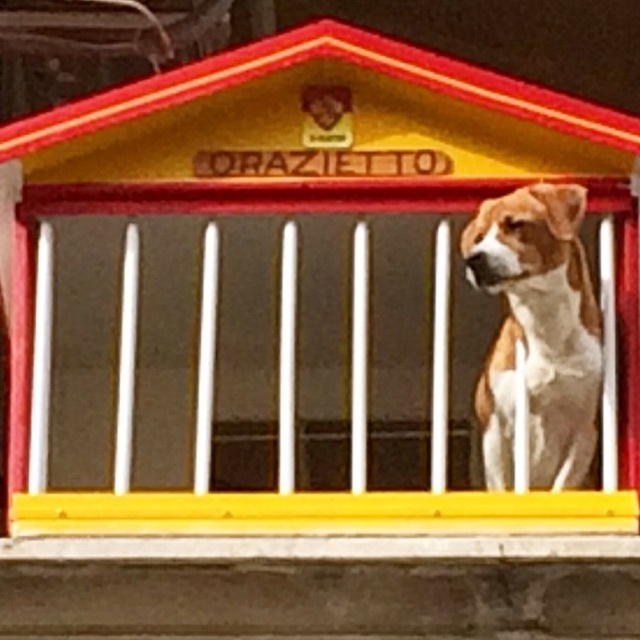
Question: Is yellow matte porch at center in front of brown and white fur dog at right?

Choices:
 (A) yes
 (B) no

Answer: (B)

Question: Which of the following is the farthest from the observer?

Choices:
 (A) brown and white fur dog at right
 (B) yellow matte porch at center

Answer: (B)

Question: Can you confirm if yellow matte porch at center is smaller than brown and white fur dog at right?

Choices:
 (A) yes
 (B) no

Answer: (B)

Question: Is yellow matte porch at center bigger than brown and white fur dog at right?

Choices:
 (A) no
 (B) yes

Answer: (B)

Question: Among these objects, which one is farthest from the camera?

Choices:
 (A) brown and white fur dog at right
 (B) yellow matte porch at center

Answer: (B)